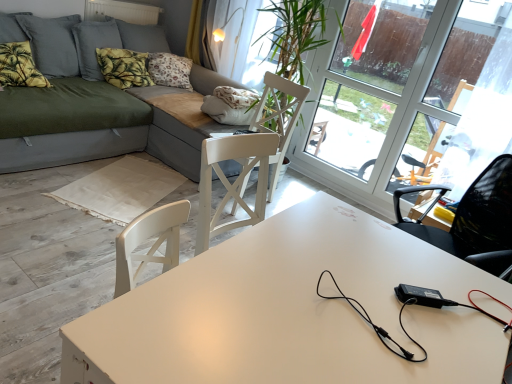
Question: Can you confirm if green leafy fabric pillow at upper left, placed as the first pillow when sorted from back to front, is bigger than yellow fabric curtain at upper center?

Choices:
 (A) yes
 (B) no

Answer: (A)

Question: From the image's perspective, would you say green leafy fabric pillow at upper left, the first pillow when ordered from right to left, is shown under yellow fabric curtain at upper center?

Choices:
 (A) no
 (B) yes

Answer: (B)

Question: Does green leafy fabric pillow at upper left, the first pillow when ordered from right to left, have a lesser height compared to yellow fabric curtain at upper center?

Choices:
 (A) no
 (B) yes

Answer: (B)

Question: Are green leafy fabric pillow at upper left, acting as the second pillow starting from the front, and yellow fabric curtain at upper center making contact?

Choices:
 (A) no
 (B) yes

Answer: (A)

Question: From a real-world perspective, is green leafy fabric pillow at upper left, which is the second pillow from left to right, beneath yellow fabric curtain at upper center?

Choices:
 (A) yes
 (B) no

Answer: (A)

Question: Is yellow fabric curtain at upper center to the left of matte gray couch at center from the viewer's perspective?

Choices:
 (A) yes
 (B) no

Answer: (B)

Question: Is yellow fabric curtain at upper center not near matte gray couch at center?

Choices:
 (A) yes
 (B) no

Answer: (A)

Question: From the image's perspective, would you say yellow fabric curtain at upper center is shown under matte gray couch at center?

Choices:
 (A) yes
 (B) no

Answer: (B)

Question: Is yellow fabric curtain at upper center to the right of matte gray couch at center from the viewer's perspective?

Choices:
 (A) yes
 (B) no

Answer: (A)

Question: From the image's perspective, does yellow fabric curtain at upper center appear higher than matte gray couch at center?

Choices:
 (A) no
 (B) yes

Answer: (B)

Question: Does yellow fabric curtain at upper center come in front of matte gray couch at center?

Choices:
 (A) no
 (B) yes

Answer: (A)

Question: From the image's perspective, is green leafy fabric pillow at upper left, the first pillow when ordered from right to left, under transparent glass window at upper right?

Choices:
 (A) no
 (B) yes

Answer: (A)